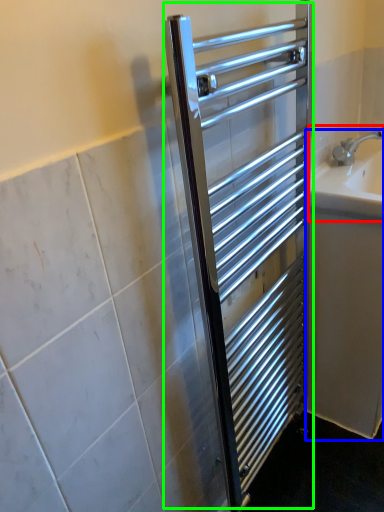
Question: Which object is positioned closest to sink (highlighted by a red box)? Select from bath (highlighted by a blue box) and screen door (highlighted by a green box).

Choices:
 (A) bath
 (B) screen door

Answer: (A)